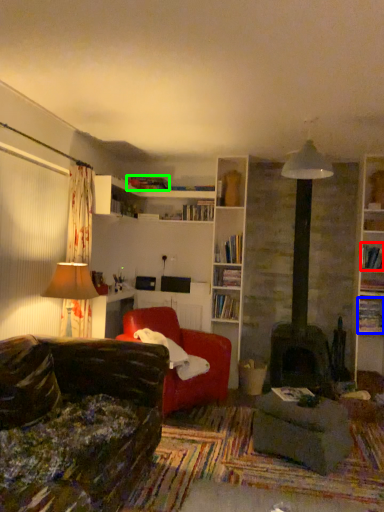
Question: Considering the real-world distances, which object is closest to book (highlighted by a red box)? book (highlighted by a blue box) or book (highlighted by a green box).

Choices:
 (A) book
 (B) book

Answer: (A)